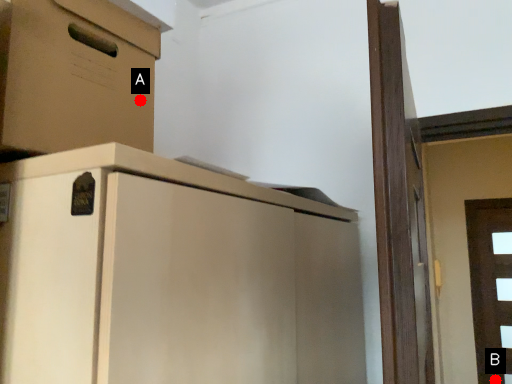
Question: Two points are circled on the image, labeled by A and B beside each circle. Which point is closer to the camera?

Choices:
 (A) A is closer
 (B) B is closer

Answer: (A)